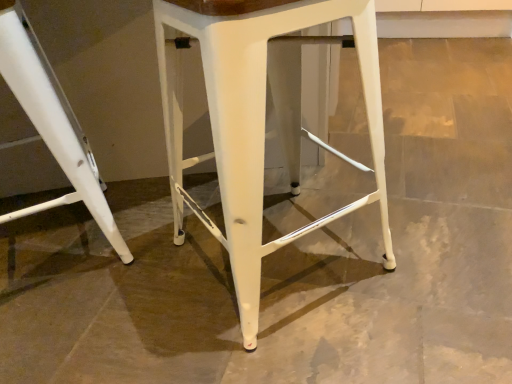
Question: Are white matte stool at left, the 2th stool when ordered from right to left, and white metal stool at center, which is counted as the first stool, starting from the right, making contact?

Choices:
 (A) no
 (B) yes

Answer: (A)

Question: Considering the relative sizes of white matte stool at left, the 2th stool when ordered from right to left, and white metal stool at center, the second stool viewed from the left, in the image provided, is white matte stool at left, the 2th stool when ordered from right to left, wider than white metal stool at center, the second stool viewed from the left,?

Choices:
 (A) yes
 (B) no

Answer: (A)

Question: Is white matte stool at left, the 2th stool when ordered from right to left, aimed at white metal stool at center, the second stool viewed from the left?

Choices:
 (A) yes
 (B) no

Answer: (B)

Question: Could white metal stool at center, which is counted as the first stool, starting from the right, be considered to be inside white matte stool at left, the 2th stool when ordered from right to left?

Choices:
 (A) yes
 (B) no

Answer: (B)

Question: Can you confirm if white matte stool at left, the 2th stool when ordered from right to left, is positioned to the right of white metal stool at center, which is counted as the first stool, starting from the right?

Choices:
 (A) yes
 (B) no

Answer: (B)

Question: Is the depth of white matte stool at left, positioned as the first stool in left-to-right order, greater than that of white metal stool at center, the second stool viewed from the left?

Choices:
 (A) yes
 (B) no

Answer: (A)

Question: Can you confirm if white metal stool at center, which is counted as the first stool, starting from the right, is positioned to the left of white matte stool at left, the 2th stool when ordered from right to left?

Choices:
 (A) yes
 (B) no

Answer: (B)

Question: From a real-world perspective, is white metal stool at center, the second stool viewed from the left, beneath white matte stool at left, positioned as the first stool in left-to-right order?

Choices:
 (A) yes
 (B) no

Answer: (B)

Question: Is white metal stool at center, which is counted as the first stool, starting from the right, oriented towards white matte stool at left, positioned as the first stool in left-to-right order?

Choices:
 (A) yes
 (B) no

Answer: (B)

Question: Does white metal stool at center, the second stool viewed from the left, touch white matte stool at left, positioned as the first stool in left-to-right order?

Choices:
 (A) no
 (B) yes

Answer: (A)

Question: Does white metal stool at center, which is counted as the first stool, starting from the right, have a greater width compared to white matte stool at left, the 2th stool when ordered from right to left?

Choices:
 (A) no
 (B) yes

Answer: (A)

Question: From the image's perspective, is white metal stool at center, which is counted as the first stool, starting from the right, on white matte stool at left, positioned as the first stool in left-to-right order?

Choices:
 (A) yes
 (B) no

Answer: (B)

Question: In terms of size, does white metal stool at center, which is counted as the first stool, starting from the right, appear bigger or smaller than white matte stool at left, positioned as the first stool in left-to-right order?

Choices:
 (A) small
 (B) big

Answer: (B)